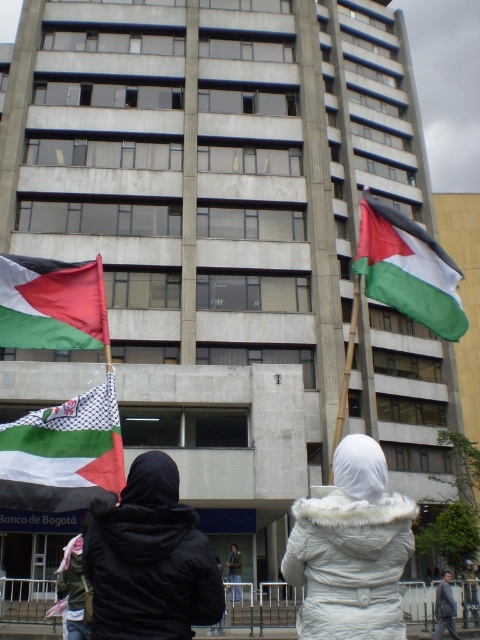
Question: Is green-white-red flag at upper right wider than black matte jacket at center?

Choices:
 (A) yes
 (B) no

Answer: (A)

Question: Based on their relative distances, which object is nearer to the black matte jacket at lower left?

Choices:
 (A) black matte jacket at center
 (B) white fur coat at lower right

Answer: (B)

Question: Can you confirm if white fur coat at center is positioned to the left of white fur coat at lower right?

Choices:
 (A) yes
 (B) no

Answer: (A)

Question: Which point appears farthest from the camera in this image?

Choices:
 (A) (402, 264)
 (B) (25, 436)
 (C) (111, 589)

Answer: (A)

Question: Can you confirm if green-white-red flag at upper right is thinner than green and white fabric flag at lower left?

Choices:
 (A) yes
 (B) no

Answer: (B)

Question: Which object appears farthest from the camera in this image?

Choices:
 (A) white and black checkered flag at lower left
 (B) black matte jacket at lower left

Answer: (A)